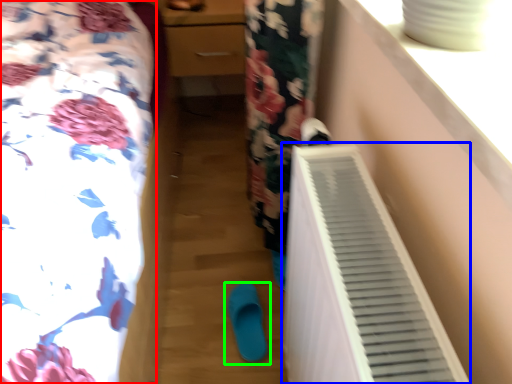
Question: Which is nearer to the furniture (highlighted by a red box)? air conditioning (highlighted by a blue box) or footwear (highlighted by a green box).

Choices:
 (A) air conditioning
 (B) footwear

Answer: (A)